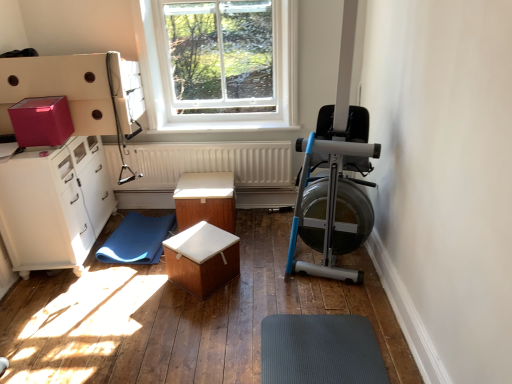
The height and width of the screenshot is (384, 512). In order to click on vacant space to the left of wooden box at center, the first table in the front-to-back sequence in this screenshot , I will do `click(145, 298)`.